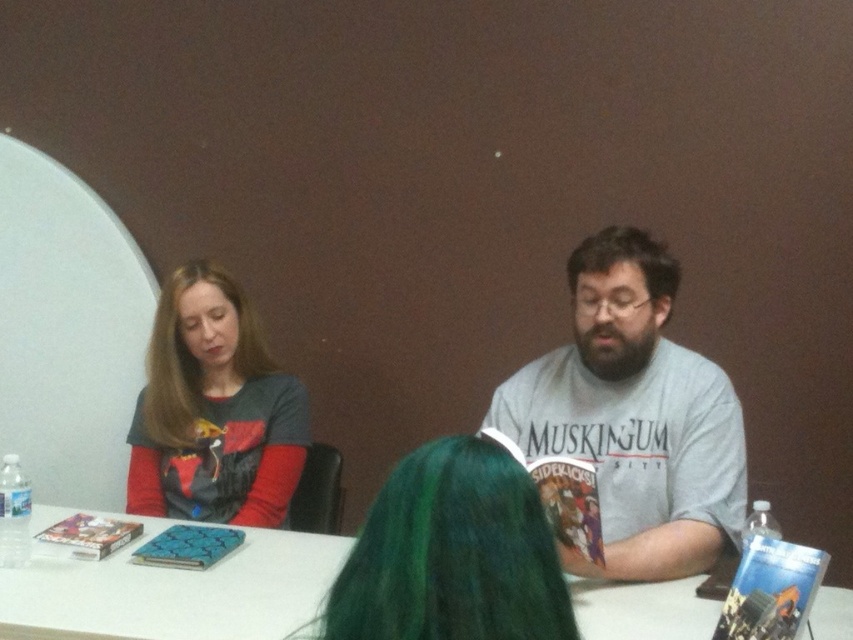
Who is more distant from viewer, (462, 632) or (144, 426)?

Positioned behind is point (144, 426).

Between point (413, 627) and point (184, 317), which one is positioned in front?

Point (413, 627)

Which is in front, point (554, 595) or point (142, 452)?

Point (554, 595) is in front.

The width and height of the screenshot is (853, 640). I want to click on green matte hair at center, so click(451, 554).

Does gray cotton shirt at center have a greater height compared to matte gray sweater at left?

Correct, gray cotton shirt at center is much taller as matte gray sweater at left.

Who is positioned more to the left, gray cotton shirt at center or matte gray sweater at left?

Positioned to the left is matte gray sweater at left.

You are a GUI agent. You are given a task and a screenshot of the screen. Output one action in this format:
    pyautogui.click(x=<x>, y=<y>)
    Task: Click on the gray cotton shirt at center
    The height and width of the screenshot is (640, 853).
    Given the screenshot: What is the action you would take?
    pyautogui.click(x=634, y=416)

You are a GUI agent. You are given a task and a screenshot of the screen. Output one action in this format:
    pyautogui.click(x=<x>, y=<y>)
    Task: Click on the gray cotton shirt at center
    Image resolution: width=853 pixels, height=640 pixels.
    Given the screenshot: What is the action you would take?
    pyautogui.click(x=634, y=416)

Which of these two, gray cotton shirt at center or dark brown hair at center, stands taller?

gray cotton shirt at center

What are the coordinates of `gray cotton shirt at center` in the screenshot? It's located at (634, 416).